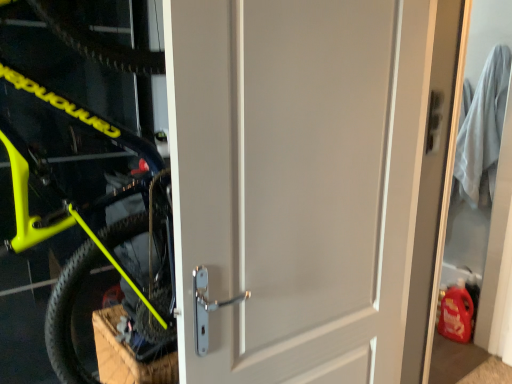
Question: From the image's perspective, would you say neon yellow matte bicycle at left is positioned over white matte door at right?

Choices:
 (A) yes
 (B) no

Answer: (A)

Question: Can you confirm if neon yellow matte bicycle at left is shorter than white matte door at right?

Choices:
 (A) no
 (B) yes

Answer: (B)

Question: Can you confirm if neon yellow matte bicycle at left is wider than white matte door at right?

Choices:
 (A) no
 (B) yes

Answer: (B)

Question: Is neon yellow matte bicycle at left in contact with white matte door at right?

Choices:
 (A) no
 (B) yes

Answer: (A)

Question: Are neon yellow matte bicycle at left and white matte door at right far apart?

Choices:
 (A) yes
 (B) no

Answer: (A)

Question: Considering the relative positions of neon yellow matte bicycle at left and white matte door at right in the image provided, is neon yellow matte bicycle at left to the left or to the right of white matte door at right?

Choices:
 (A) left
 (B) right

Answer: (A)

Question: Is point (54, 291) positioned closer to the camera than point (476, 225)?

Choices:
 (A) closer
 (B) farther

Answer: (A)

Question: In terms of width, does neon yellow matte bicycle at left look wider or thinner when compared to white matte door at right?

Choices:
 (A) thin
 (B) wide

Answer: (B)

Question: Considering the positions of neon yellow matte bicycle at left and white matte door at right in the image, is neon yellow matte bicycle at left taller or shorter than white matte door at right?

Choices:
 (A) tall
 (B) short

Answer: (B)

Question: Looking at the image, does neon yellow matte bicycle at left seem bigger or smaller compared to white matte door at center?

Choices:
 (A) small
 (B) big

Answer: (B)

Question: From a real-world perspective, is neon yellow matte bicycle at left above or below white matte door at center?

Choices:
 (A) above
 (B) below

Answer: (A)

Question: In terms of width, does neon yellow matte bicycle at left look wider or thinner when compared to white matte door at center?

Choices:
 (A) wide
 (B) thin

Answer: (A)

Question: In the image, is neon yellow matte bicycle at left on the left side or the right side of white matte door at center?

Choices:
 (A) right
 (B) left

Answer: (B)

Question: In terms of size, does white matte door at center appear bigger or smaller than white matte door at right?

Choices:
 (A) small
 (B) big

Answer: (A)

Question: From their relative heights in the image, would you say white matte door at center is taller or shorter than white matte door at right?

Choices:
 (A) short
 (B) tall

Answer: (A)